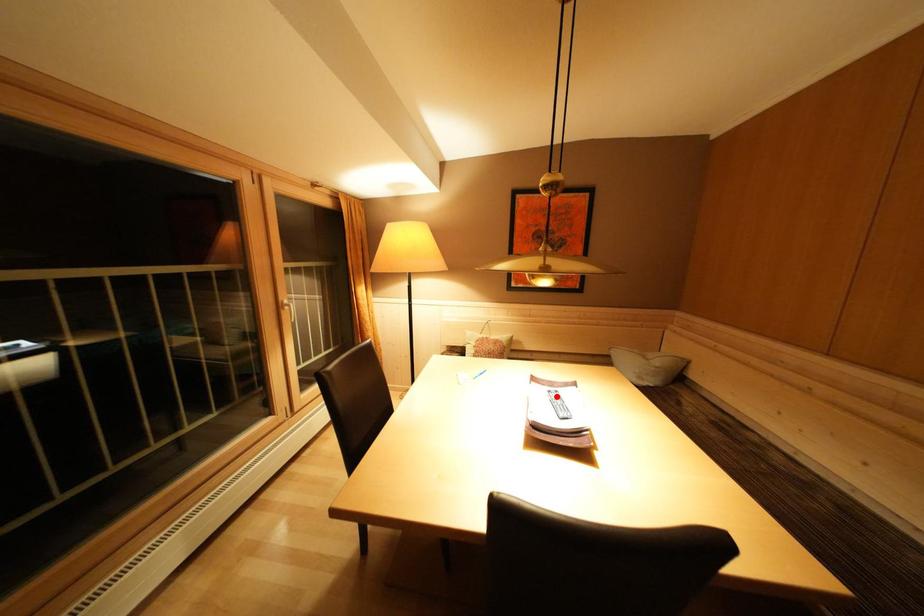
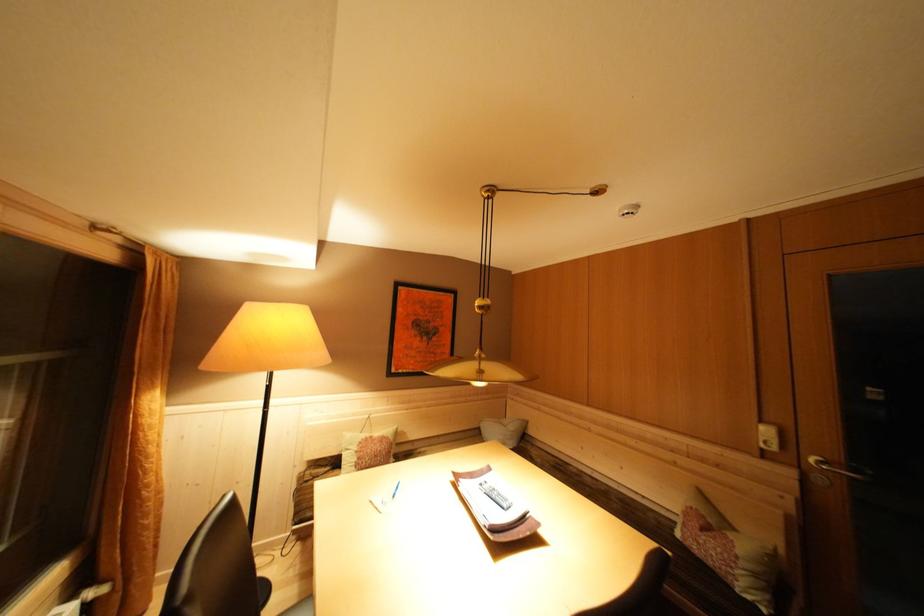
Find the pixel in the second image that matches the highlighted location in the first image.

(488, 488)